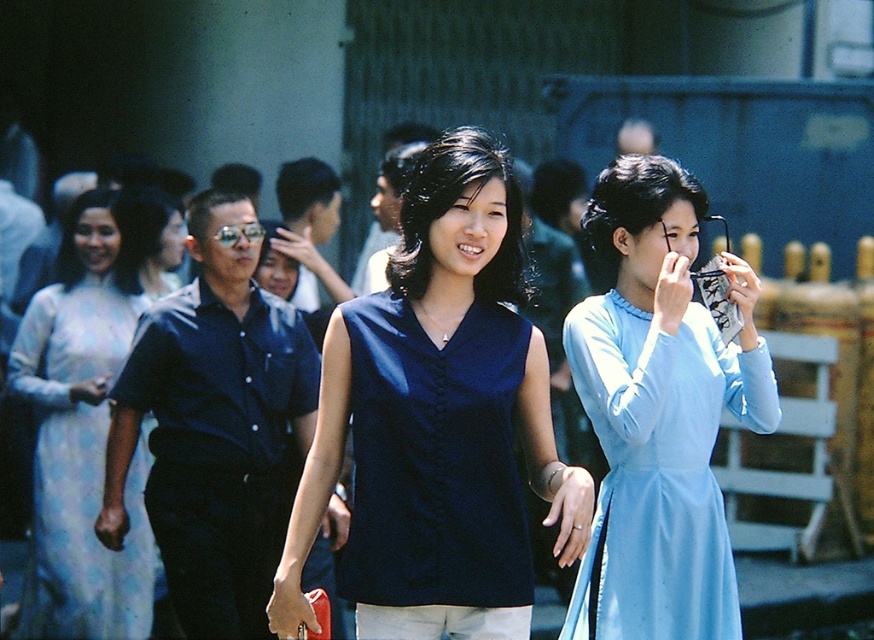
Question: Considering the relative positions of matte blue blouse at center and navy blue fabric dress at center in the image provided, where is matte blue blouse at center located with respect to navy blue fabric dress at center?

Choices:
 (A) left
 (B) right

Answer: (B)

Question: Estimate the real-world distances between objects in this image. Which object is closer to the navy blue fabric dress at center?

Choices:
 (A) light blue silk dress at center
 (B) shiny blue shirt at center
 (C) matte blue blouse at center
 (D) white silk ao dai at left

Answer: (C)

Question: Which of these objects is positioned closest to the shiny blue shirt at center?

Choices:
 (A) light blue silk dress at center
 (B) navy blue fabric dress at center
 (C) white silk ao dai at left

Answer: (C)

Question: Is matte blue blouse at center closer to the viewer compared to white silk ao dai at left?

Choices:
 (A) no
 (B) yes

Answer: (B)

Question: Does navy blue fabric dress at center have a smaller size compared to white silk ao dai at left?

Choices:
 (A) yes
 (B) no

Answer: (A)

Question: Which point is farther to the camera?

Choices:
 (A) navy blue fabric dress at center
 (B) light blue silk dress at center
 (C) matte blue blouse at center

Answer: (B)